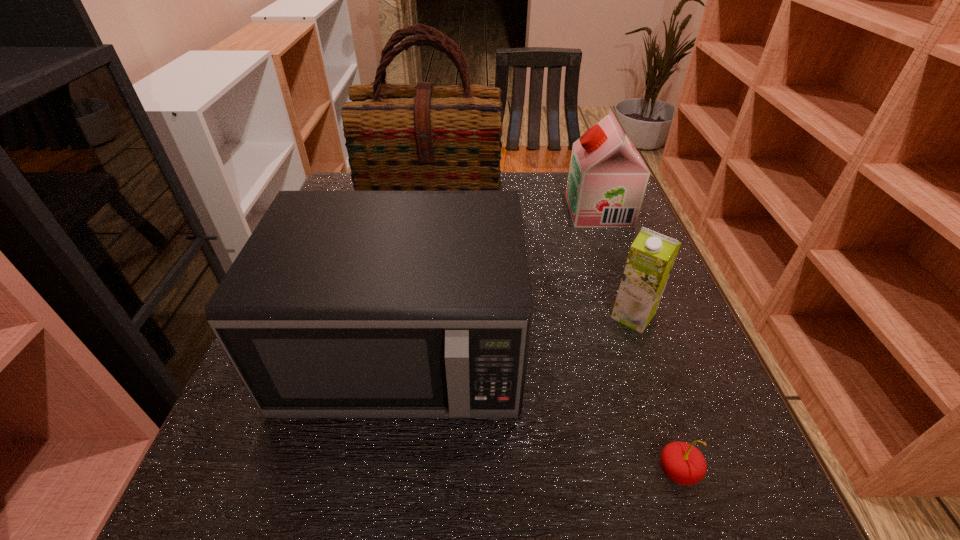
This screenshot has width=960, height=540. Identify the location of the tallest object. (398, 137).

The width and height of the screenshot is (960, 540). I want to click on the farther soya milk, so click(x=607, y=179).

Where is `microwave oven`? The image size is (960, 540). microwave oven is located at coordinates (342, 304).

Find the location of a particular element. the shorter soya milk is located at coordinates (652, 255).

Image resolution: width=960 pixels, height=540 pixels. Find the location of `the second shortest object`. the second shortest object is located at coordinates (652, 255).

Where is `the nearest object`? This screenshot has height=540, width=960. the nearest object is located at coordinates (681, 462).

What are the coordinates of `cherry` in the screenshot? It's located at (681, 462).

Locate an element on the screen. The width and height of the screenshot is (960, 540). free spot located 0.320m on the open handle side of the tallest object is located at coordinates [x=416, y=328].

The width and height of the screenshot is (960, 540). I want to click on vacant space located with the cap open on the farther soya milk, so click(465, 211).

At what (x,y) coordinates should I click in order to perform the action: click on vacant space located with the cap open on the farther soya milk. Please return your answer as a coordinate pair (x, y). The image size is (960, 540). Looking at the image, I should click on (420, 211).